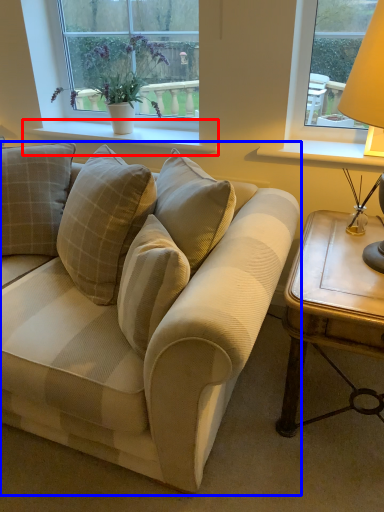
Question: Which object is closer to the camera taking this photo, window sill (highlighted by a red box) or studio couch (highlighted by a blue box)?

Choices:
 (A) window sill
 (B) studio couch

Answer: (B)